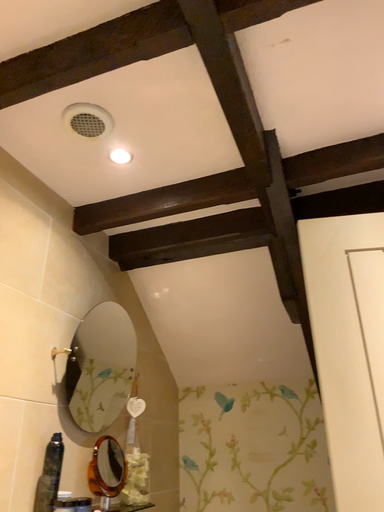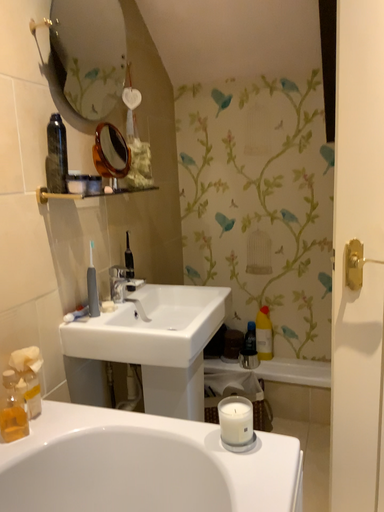
Question: Which way did the camera rotate in the video?

Choices:
 (A) rotated upward
 (B) rotated downward

Answer: (B)